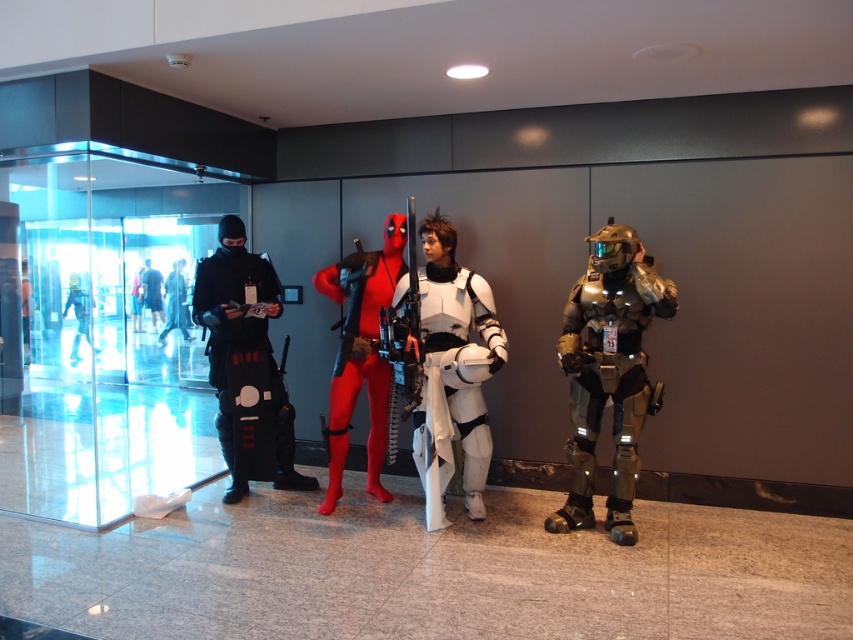
Question: Which object is the farthest from the black matte ninja at left?

Choices:
 (A) white matte armor at center
 (B) rubberized red suit at center
 (C) black matte costume at left
 (D) gold metallic armor at right

Answer: (D)

Question: Based on their relative distances, which object is farther from the white matte armor at center?

Choices:
 (A) rubberized red suit at center
 (B) black matte ninja at left

Answer: (B)

Question: From the image, what is the correct spatial relationship of black matte ninja suit at left in relation to black matte ninja at left?

Choices:
 (A) above
 (B) below

Answer: (B)

Question: Can you confirm if white matte armor at center is smaller than black matte ninja at left?

Choices:
 (A) yes
 (B) no

Answer: (B)

Question: Which of these objects is positioned farthest from the black matte costume at left?

Choices:
 (A) gold metallic armor at right
 (B) black matte ninja at left
 (C) black matte ninja suit at left
 (D) white matte armor at center

Answer: (B)

Question: Can you confirm if white matte armor at center is positioned to the right of black matte costume at left?

Choices:
 (A) no
 (B) yes

Answer: (B)